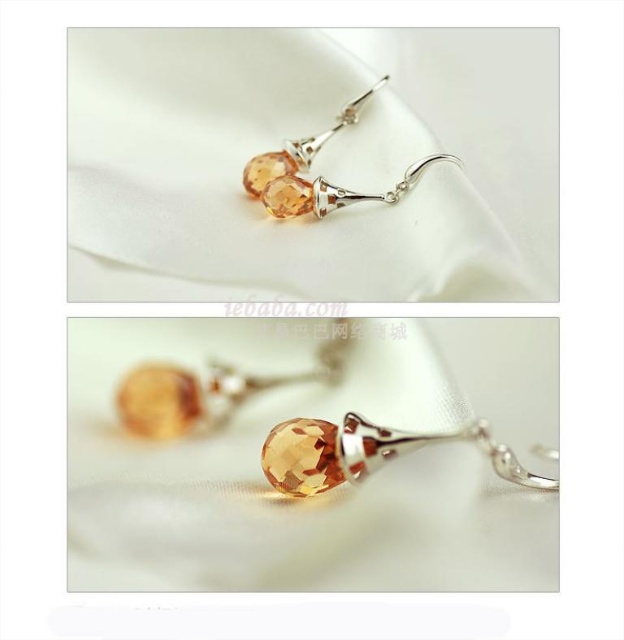
Question: Can you confirm if citrine crystal drop at center is positioned below citrine glass drop at center?

Choices:
 (A) yes
 (B) no

Answer: (A)

Question: Can you confirm if citrine crystal drop at center is wider than citrine glass drop at center?

Choices:
 (A) yes
 (B) no

Answer: (A)

Question: Is citrine crystal drop at center wider than citrine glass drop at center?

Choices:
 (A) yes
 (B) no

Answer: (A)

Question: Which of the following is the farthest from the observer?

Choices:
 (A) citrine crystal drop at center
 (B) citrine glass drop at center

Answer: (B)